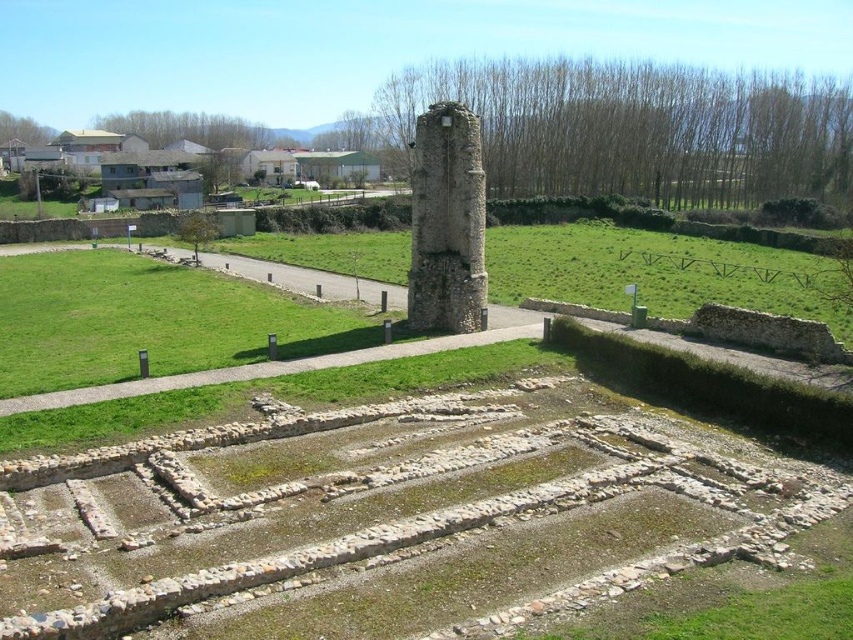
Does green grass at center appear over weathered stone pillar at center?

Actually, green grass at center is below weathered stone pillar at center.

In the scene shown: Who is lower down, green grass at center or weathered stone pillar at center?

green grass at center is lower down.

At what (x,y) coordinates should I click in order to perform the action: click on green grass at center. Please return your answer as a coordinate pair (x, y). Looking at the image, I should click on (154, 321).